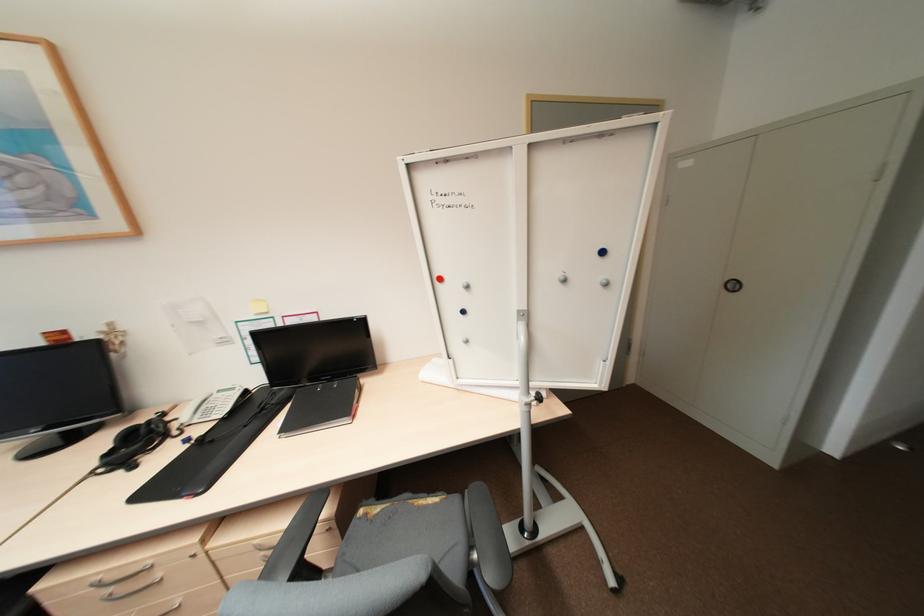
Where would you sit the chair sitting surface? Please return your answer as a coordinate pair (x, y).

(392, 507)